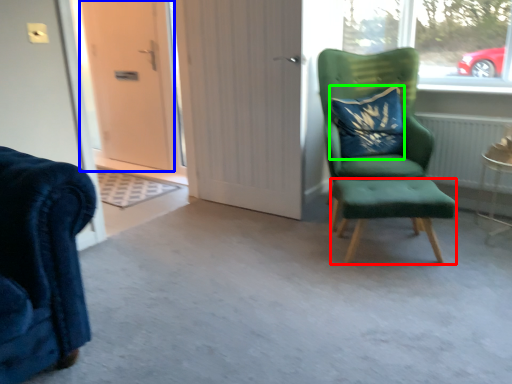
Question: Which object is positioned farthest from stool (highlighted by a red box)? Select from door (highlighted by a blue box) and pillow (highlighted by a green box).

Choices:
 (A) door
 (B) pillow

Answer: (A)